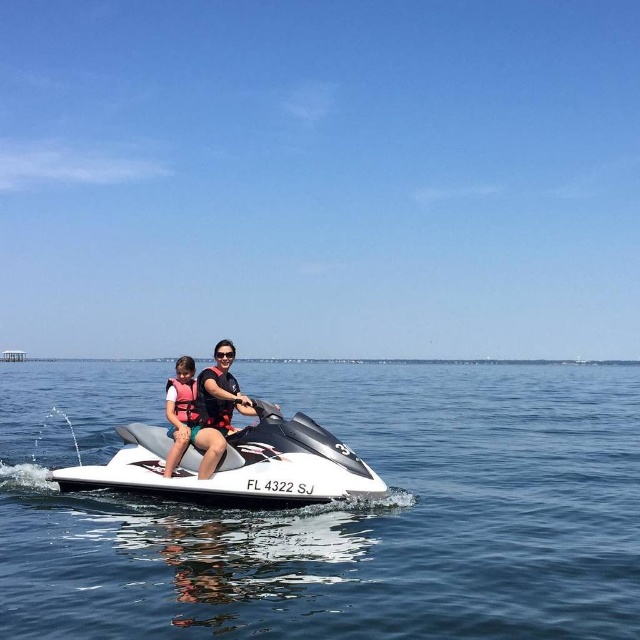
Where is `matte black jet ski at center`? This screenshot has height=640, width=640. matte black jet ski at center is located at coordinates (204, 410).

Does point (176, 451) come farther from viewer compared to point (182, 438)?

That is True.

Is point (227, 420) closer to viewer compared to point (172, 452)?

No, (227, 420) is further to viewer.

Find the location of a particular element. matte black jet ski at center is located at coordinates (204, 410).

Is point (36, 532) positioned after point (273, 499)?

Yes.

Between clear blue water at center and white glossy jet ski at center, which one appears on the right side from the viewer's perspective?

Positioned to the right is white glossy jet ski at center.

Which is behind, point (580, 417) or point (81, 484)?

The point (580, 417) is more distant.

Locate an element on the screen. The image size is (640, 640). clear blue water at center is located at coordinates coord(337,509).

Can you confirm if white glossy jet ski at center is shorter than matte black jet ski at center?

Yes.

Between white glossy jet ski at center and matte black jet ski at center, which one appears on the right side from the viewer's perspective?

Positioned to the right is matte black jet ski at center.

The width and height of the screenshot is (640, 640). Identify the location of white glossy jet ski at center. (236, 467).